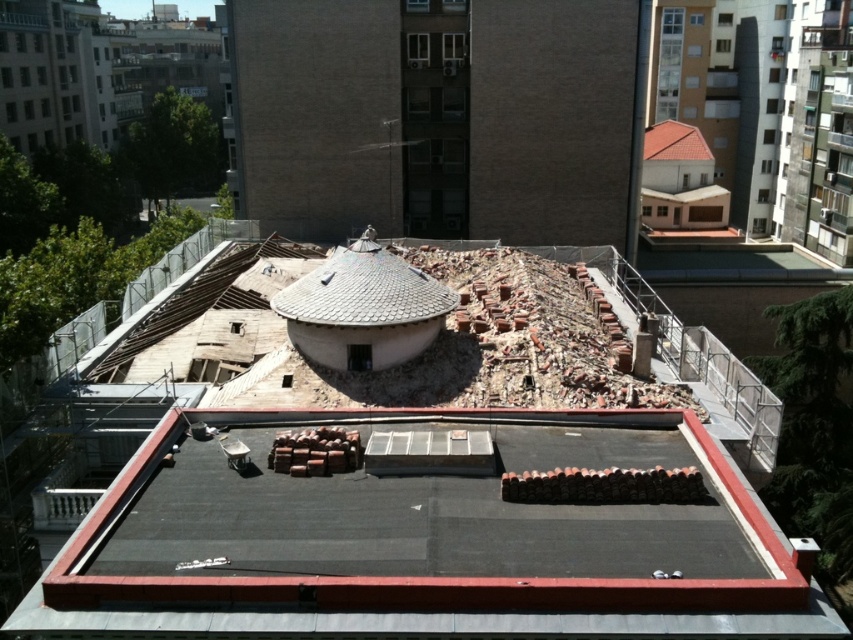
You are a construction worker who needs to move a 2.5 meter long beam from the brick rubble at center to the gray tile dome at center. Can you move it without bending or shortening the beam?

The distance between the brick rubble at center and the gray tile dome at center is 4.41 meters. Since the beam is 2.5 meters long, it can be moved in one piece without bending or shortening because the distance is greater than the beam length.

You are standing on the rooftop and want to move towards the brick rubble at center. The safe distance for approaching the rubble is at least 12 meters. Is the current distance safe?

The brick rubble at center is 11.59 meters away from viewer, which is less than the required 12 meters for safety. Therefore, the current distance is not safe.

You are an architect inspecting the rooftop. You need to determine if the gray tile dome at center can be moved closer to the red shingles at upper right without overlapping. Based on their widths, is this possible?

The gray tile dome at center is wider than the red shingles at upper right, so moving them closer might cause overlap since the dome is wider. Ensure there is enough space between them to avoid overlapping.